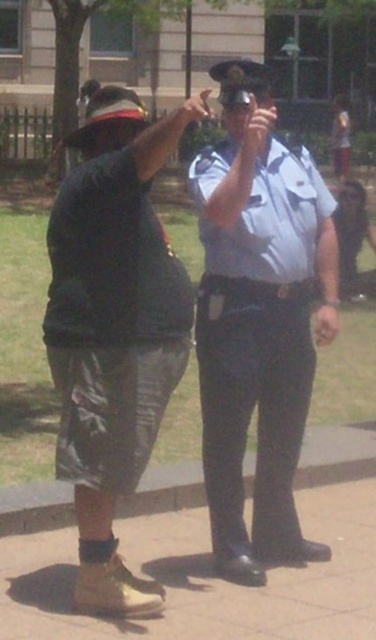
You are a delivery person who needs to leave a package at the location shown. The package must be placed on the ground near the brown leather shoe at lower left and matte black uniform at center. Can you place the package between them?

The brown leather shoe at lower left is to the left of the matte black uniform at center, so yes, you can place the package between them as there is space between the two objects.

What is the 2D coordinate of the white uniform shirt at center?

The white uniform shirt at center is located at the 2D coordinate point of (257,321).

You are a photographer trying to capture a group photo of the two people in the image. The white uniform shirt at center and the matte black shirt at center. Since you want everyone to be visible, should you adjust the camera angle to look up or down when taking the photo?

The white uniform shirt at center is much taller than the matte black shirt at center. To ensure both are visible in the photo, you should adjust the camera angle to look down so that the shorter matte black shirt at center is not obscured by the taller white uniform shirt at center.